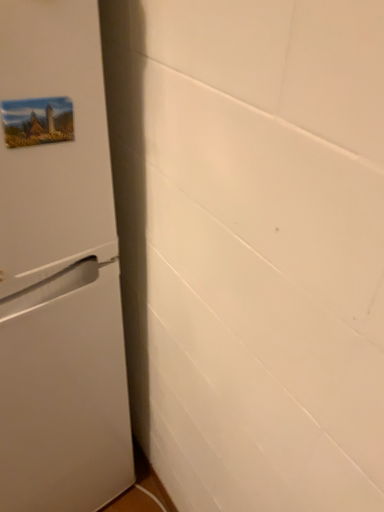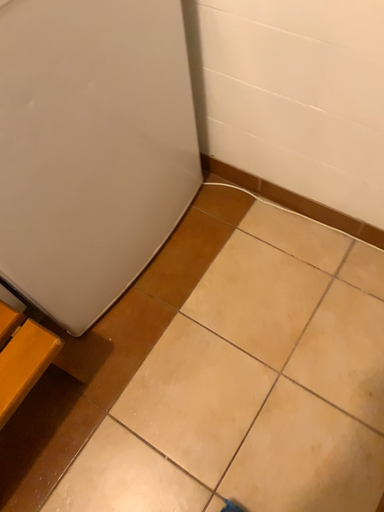
Question: How did the camera likely rotate when shooting the video?

Choices:
 (A) rotated left
 (B) rotated right

Answer: (B)